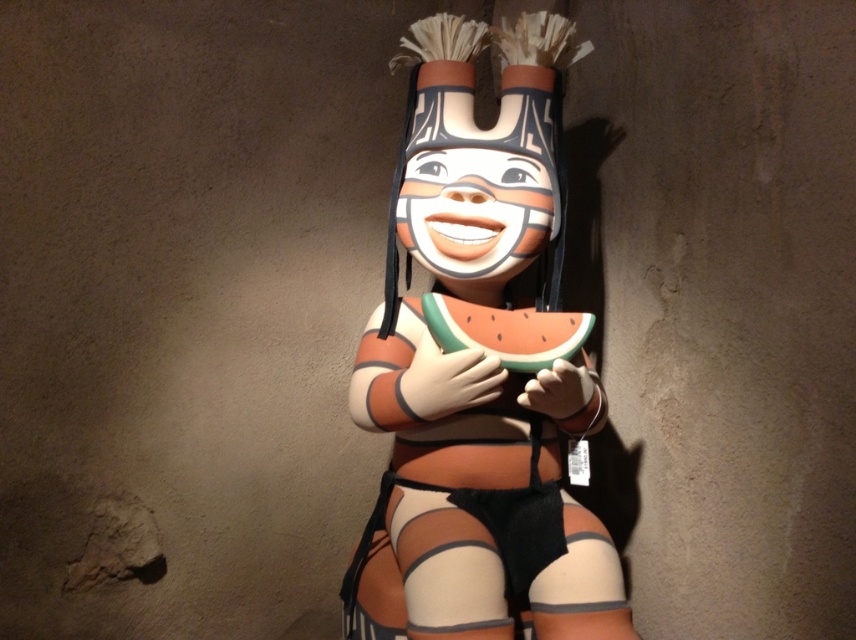
Is matte plastic kachina doll at center shorter than green matte watermelon at center?

Incorrect, matte plastic kachina doll at center's height does not fall short of green matte watermelon at center's.

Find the location of a particular element. matte plastic kachina doll at center is located at coordinates (480, 365).

This screenshot has height=640, width=856. I want to click on matte plastic kachina doll at center, so click(x=480, y=365).